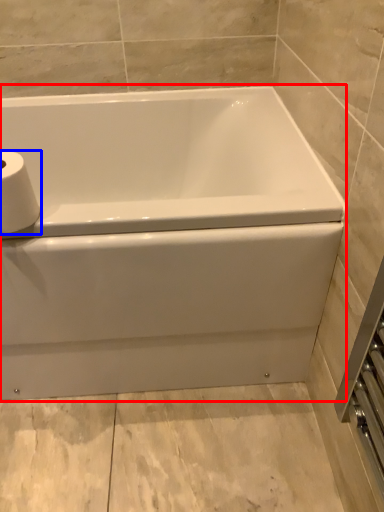
Question: Which object appears farthest to the camera in this image, bathtub (highlighted by a red box) or toilet paper (highlighted by a blue box)?

Choices:
 (A) bathtub
 (B) toilet paper

Answer: (A)